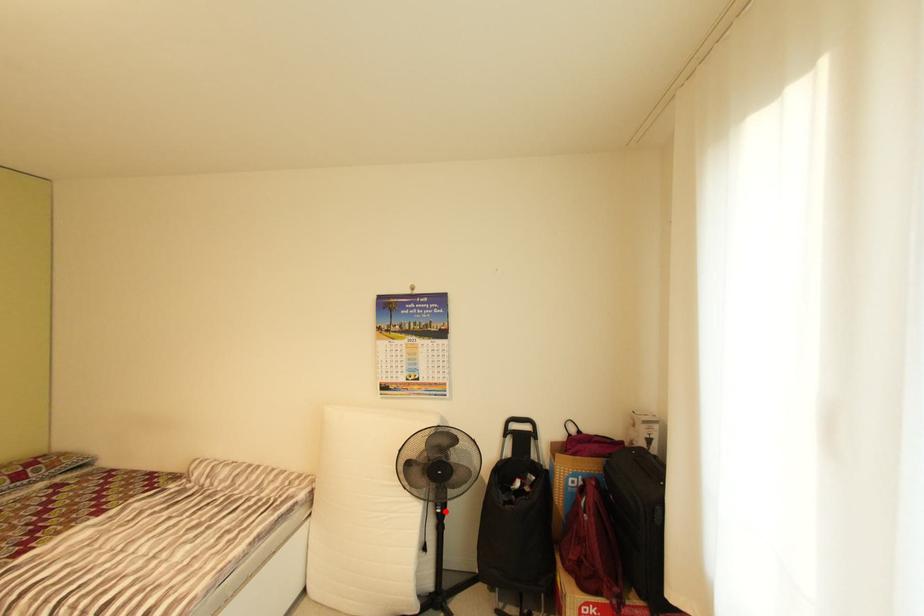
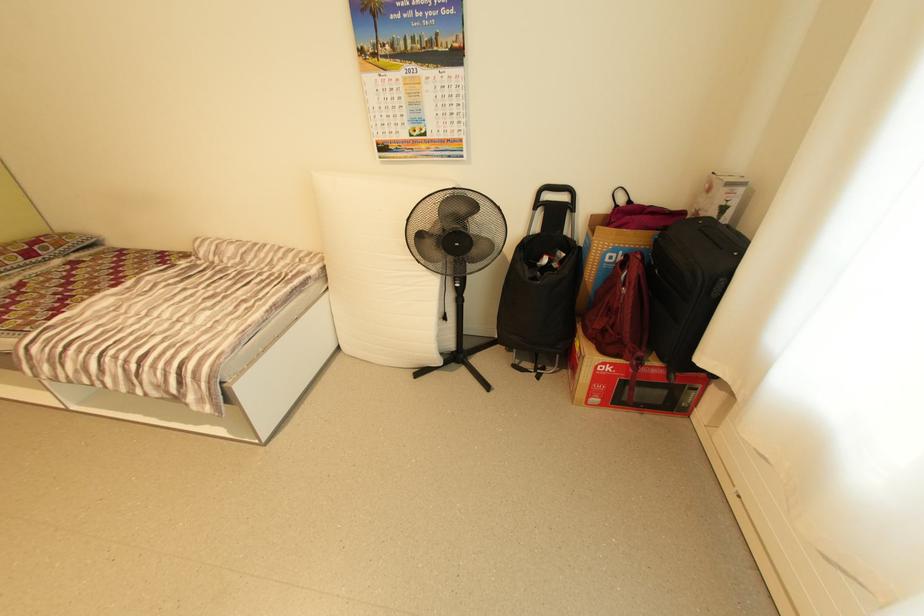
Question: I am providing you with two images of the same scene from different viewpoints. Given a red point in image1, look at the same physical point in image2. Is it:

Choices:
 (A) Closer to the viewpoint
 (B) Farther from the viewpoint

Answer: (A)